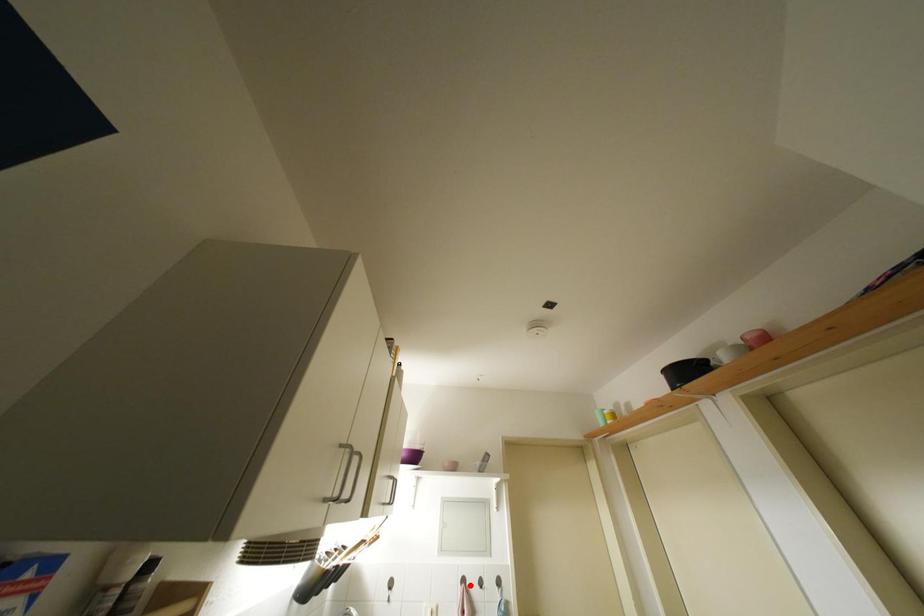
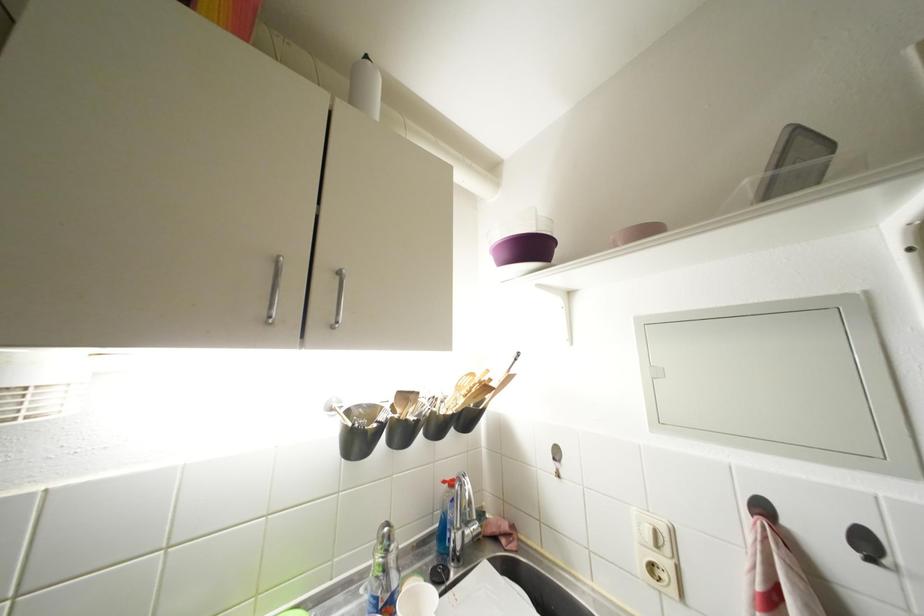
Find the pixel in the second image that matches the highlighted location in the first image.

(770, 513)